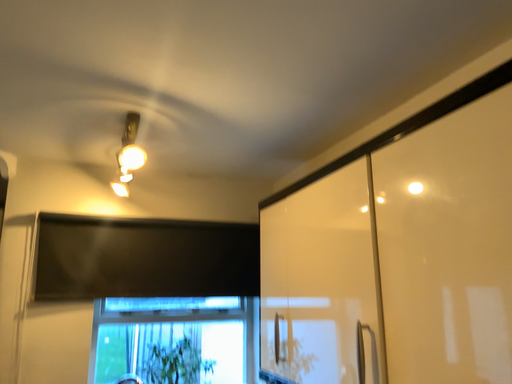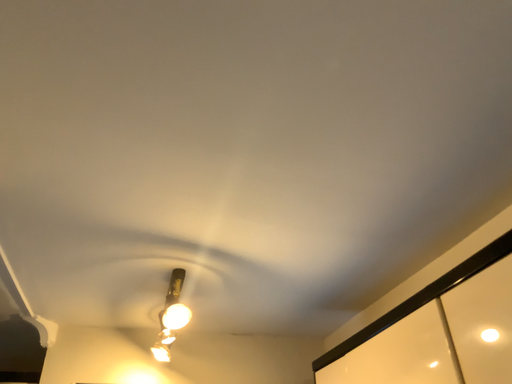
Question: Which way did the camera rotate in the video?

Choices:
 (A) rotated downward
 (B) rotated upward

Answer: (B)